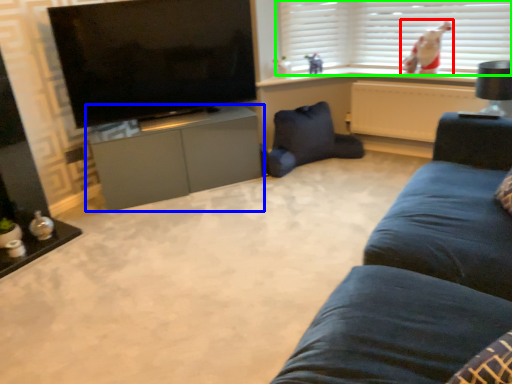
Question: Which object is the farthest from person (highlighted by a red box)? Choose among these: cabinetry (highlighted by a blue box) or window blind (highlighted by a green box).

Choices:
 (A) cabinetry
 (B) window blind

Answer: (A)